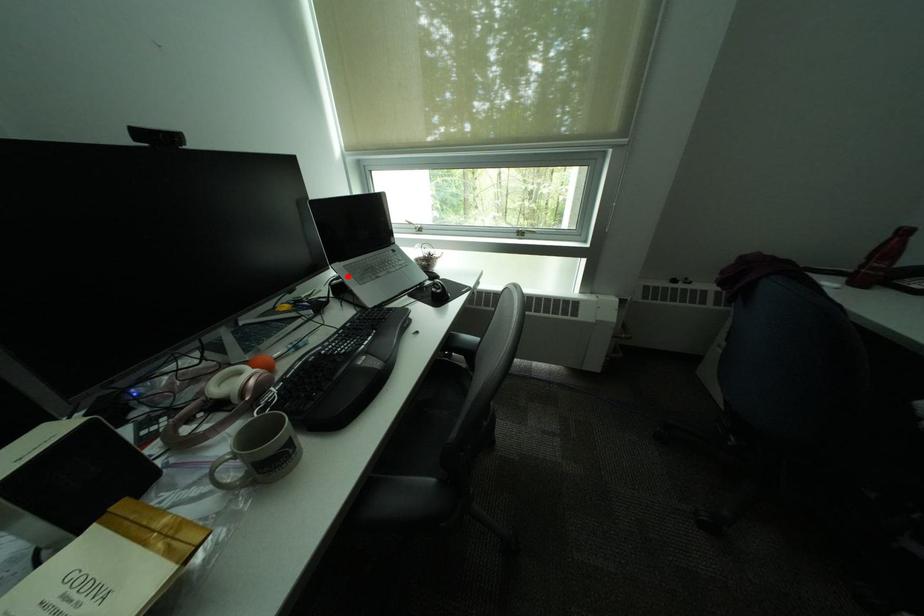
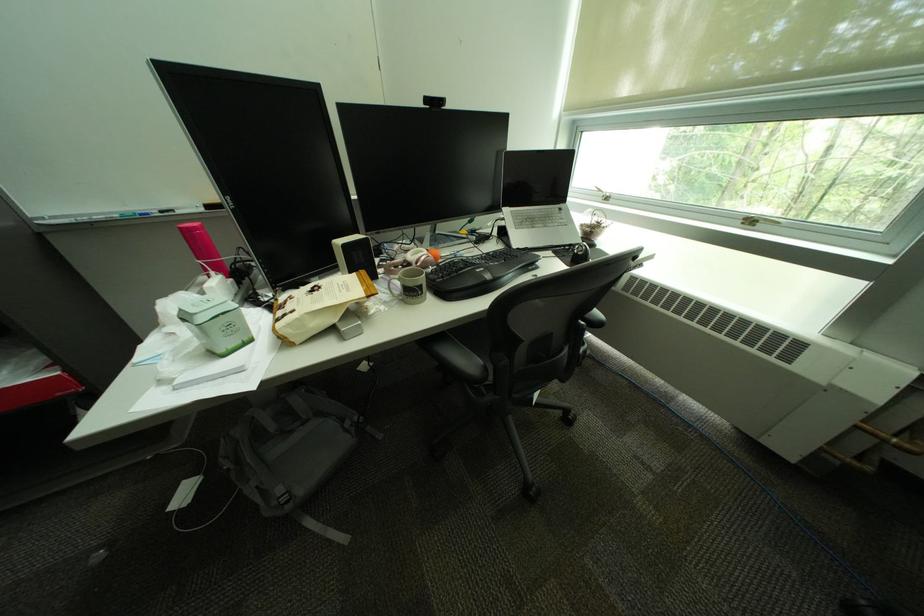
Locate, in the second image, the point that corresponds to the highlighted location in the first image.

(514, 217)